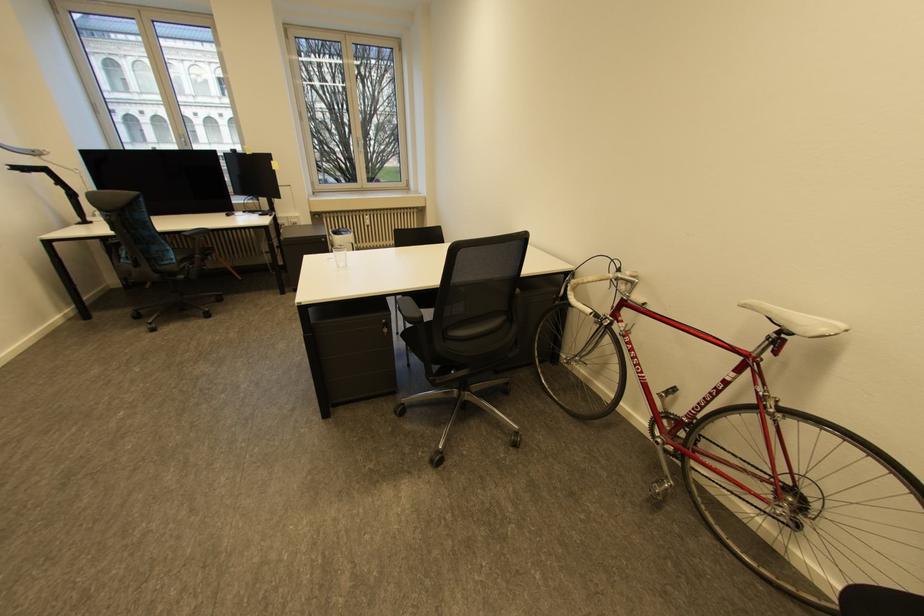
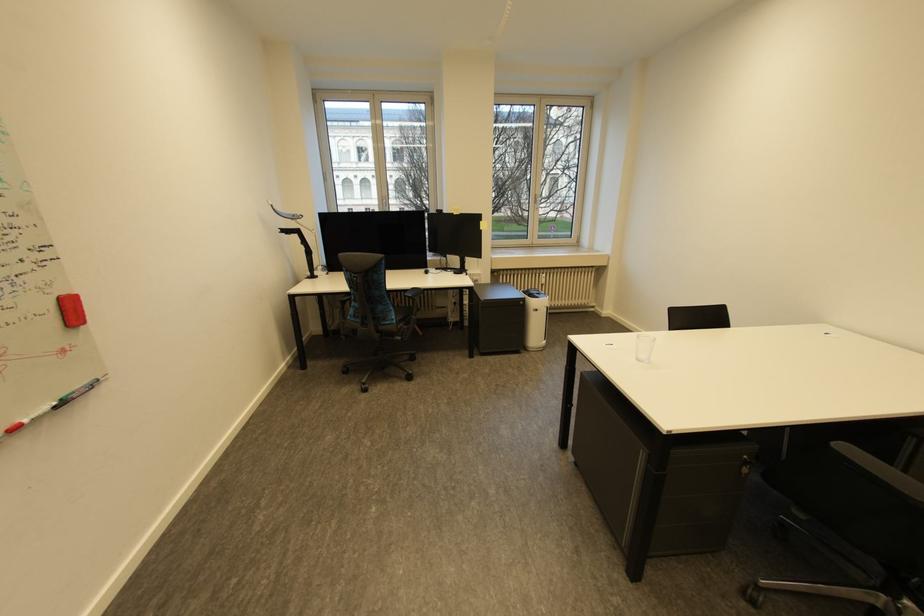
The point at (x=391, y=322) is marked in the first image. Where is the corresponding point in the second image?

(752, 456)